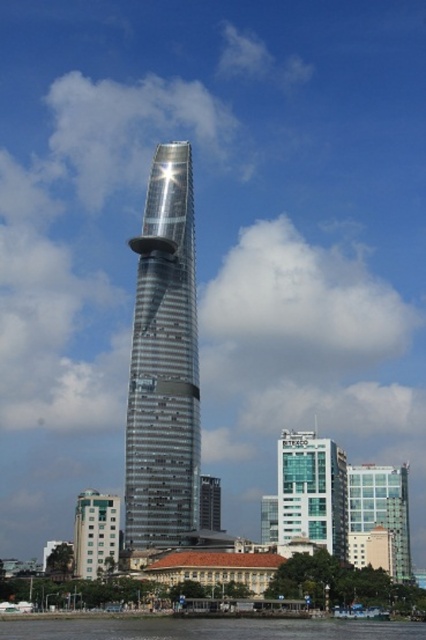
Does transparent water at lower center have a greater height compared to glassy transparent building at center?

Incorrect, transparent water at lower center's height is not larger of glassy transparent building at center's.

Who is more distant from viewer, (158, 628) or (379, 524)?

Point (379, 524)

What do you see at coordinates (207, 628) in the screenshot? I see `transparent water at lower center` at bounding box center [207, 628].

Locate an element on the screen. This screenshot has width=426, height=640. transparent water at lower center is located at coordinates (207, 628).

Which of these two, silver metallic skyscraper at center or glassy metallic skyscraper at center, stands taller?

With more height is silver metallic skyscraper at center.

Which is in front, point (152, 440) or point (215, 522)?

Positioned in front is point (152, 440).

Where is `silver metallic skyscraper at center`? silver metallic skyscraper at center is located at coordinates (164, 364).

Can you confirm if green glass building at lower left is smaller than glassy metallic skyscraper at center?

Result: Correct, green glass building at lower left occupies less space than glassy metallic skyscraper at center.

Does green glass building at lower left appear on the left side of glassy metallic skyscraper at center?

Correct, you'll find green glass building at lower left to the left of glassy metallic skyscraper at center.

Is point (101, 516) positioned in front of point (209, 481)?

Yes.

I want to click on green glass building at lower left, so click(x=95, y=532).